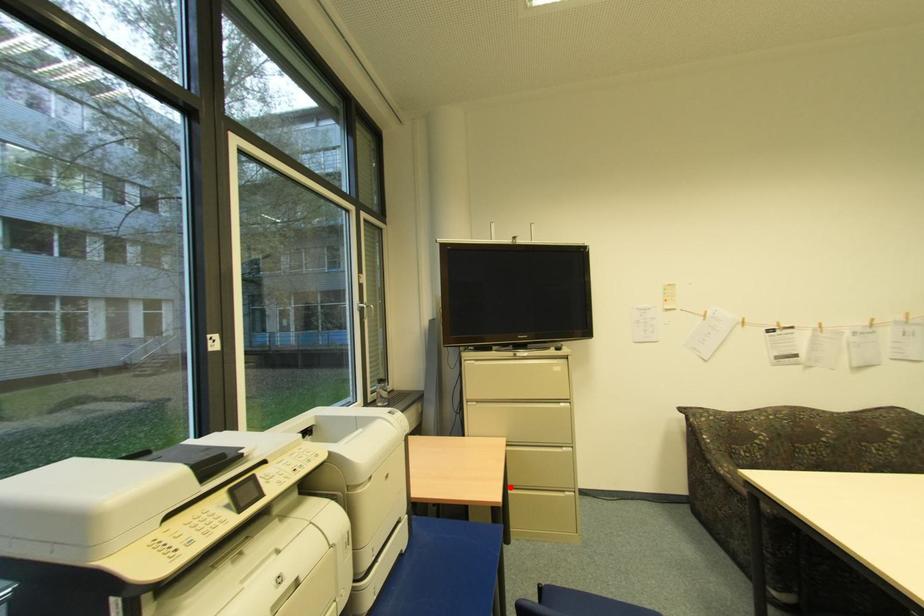
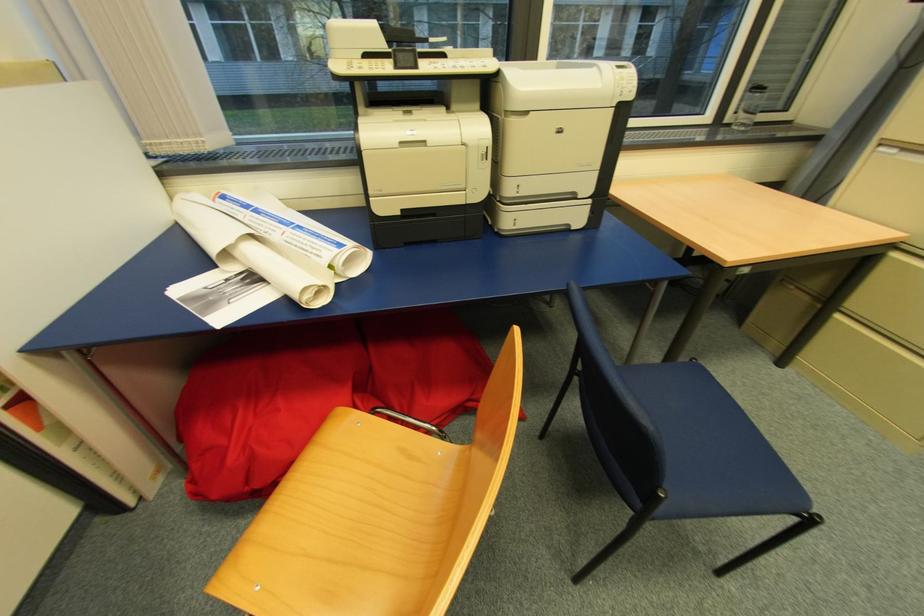
Locate, in the second image, the point that corresponds to the highlighted location in the first image.

(845, 310)